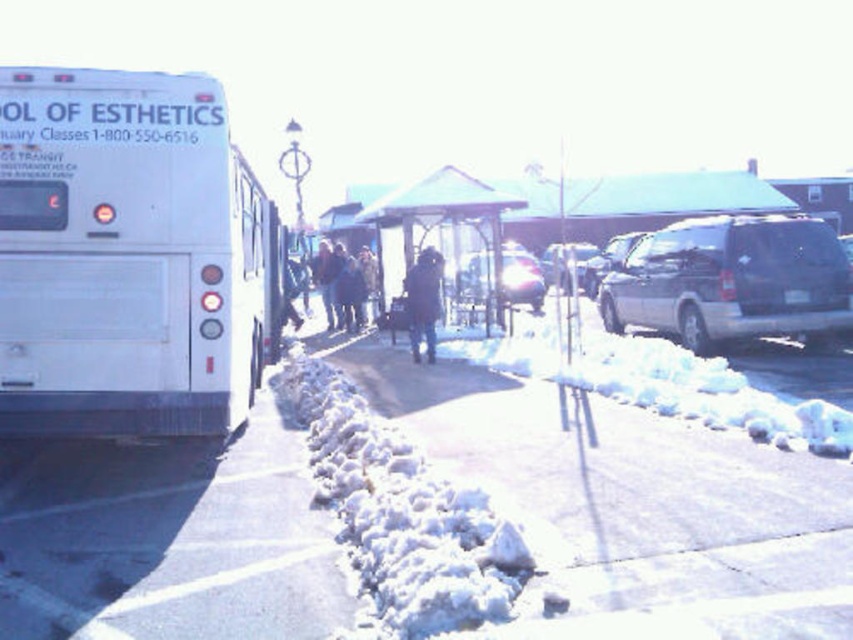
Does silver metallic van at right have a greater width compared to transparent glass bus stop at center?

Yes.

Can you confirm if silver metallic van at right is bigger than transparent glass bus stop at center?

Yes.

Is point (677, 328) farther from viewer compared to point (398, 273)?

No, (677, 328) is closer to viewer.

Locate an element on the screen. This screenshot has height=640, width=853. silver metallic van at right is located at coordinates (732, 282).

Between point (383, 214) and point (367, 291), which one is positioned in front?

Point (383, 214)

This screenshot has width=853, height=640. Describe the element at coordinates (440, 225) in the screenshot. I see `transparent glass bus stop at center` at that location.

The image size is (853, 640). I want to click on transparent glass bus stop at center, so click(x=440, y=225).

Who is lower down, dark brown coat at center or satin silver van at right?

dark brown coat at center

Is dark brown coat at center thinner than satin silver van at right?

Correct, dark brown coat at center's width is less than satin silver van at right's.

Locate an element on the screen. The image size is (853, 640). dark brown coat at center is located at coordinates (422, 301).